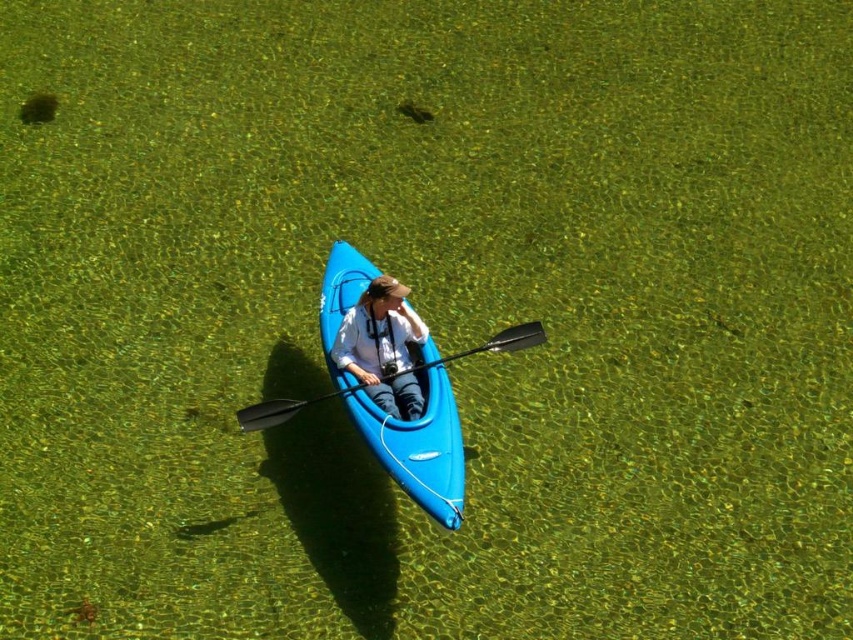
Who is taller, blue plastic canoe at center or white fabric person at center?

With more height is blue plastic canoe at center.

Who is more forward, (320, 339) or (409, 324)?

Positioned in front is point (409, 324).

Identify the location of blue plastic canoe at center. This screenshot has width=853, height=640. (419, 445).

Which is behind, point (387, 324) or point (498, 348)?

The point (387, 324) is more distant.

Does white fabric person at center appear on the right side of black plastic paddle at center?

In fact, white fabric person at center is to the left of black plastic paddle at center.

Which is behind, point (395, 368) or point (494, 336)?

Point (494, 336)

You are a GUI agent. You are given a task and a screenshot of the screen. Output one action in this format:
    pyautogui.click(x=<x>, y=<y>)
    Task: Click on the white fabric person at center
    The height and width of the screenshot is (640, 853).
    Given the screenshot: What is the action you would take?
    pyautogui.click(x=381, y=348)

Who is positioned more to the left, blue plastic canoe at center or black plastic paddle at center?

black plastic paddle at center

Which of these two, blue plastic canoe at center or black plastic paddle at center, stands shorter?

black plastic paddle at center is shorter.

Between point (341, 291) and point (279, 420), which one is positioned in front?

Point (279, 420) is in front.

Locate an element on the screen. This screenshot has height=640, width=853. blue plastic canoe at center is located at coordinates (419, 445).